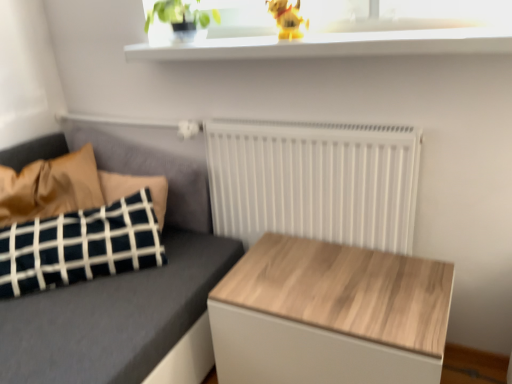
Question: Should I look upward or downward to see white matte radiator at center?

Choices:
 (A) up
 (B) down

Answer: (B)

Question: Is white matte radiator at center positioned with its back to yellow plastic dog at upper center?

Choices:
 (A) yes
 (B) no

Answer: (B)

Question: Is white matte radiator at center directly adjacent to yellow plastic dog at upper center?

Choices:
 (A) no
 (B) yes

Answer: (A)

Question: Is white matte radiator at center wider than yellow plastic dog at upper center?

Choices:
 (A) yes
 (B) no

Answer: (B)

Question: From a real-world perspective, is white matte radiator at center over yellow plastic dog at upper center?

Choices:
 (A) yes
 (B) no

Answer: (B)

Question: Could yellow plastic dog at upper center be considered to be inside white matte radiator at center?

Choices:
 (A) yes
 (B) no

Answer: (B)

Question: Can you confirm if white matte radiator at center is bigger than yellow plastic dog at upper center?

Choices:
 (A) yes
 (B) no

Answer: (A)

Question: Is white glossy window sill at upper center bigger than green matte plant at upper center?

Choices:
 (A) no
 (B) yes

Answer: (B)

Question: Is green matte plant at upper center inside white glossy window sill at upper center?

Choices:
 (A) no
 (B) yes

Answer: (A)

Question: From a real-world perspective, is white glossy window sill at upper center physically below green matte plant at upper center?

Choices:
 (A) no
 (B) yes

Answer: (B)

Question: Is white glossy window sill at upper center looking in the opposite direction of green matte plant at upper center?

Choices:
 (A) no
 (B) yes

Answer: (A)

Question: From a real-world perspective, is white glossy window sill at upper center physically above green matte plant at upper center?

Choices:
 (A) no
 (B) yes

Answer: (A)

Question: Is white glossy window sill at upper center at the left side of green matte plant at upper center?

Choices:
 (A) no
 (B) yes

Answer: (A)

Question: Does white matte radiator at center have a smaller size compared to wooden table at center?

Choices:
 (A) yes
 (B) no

Answer: (A)